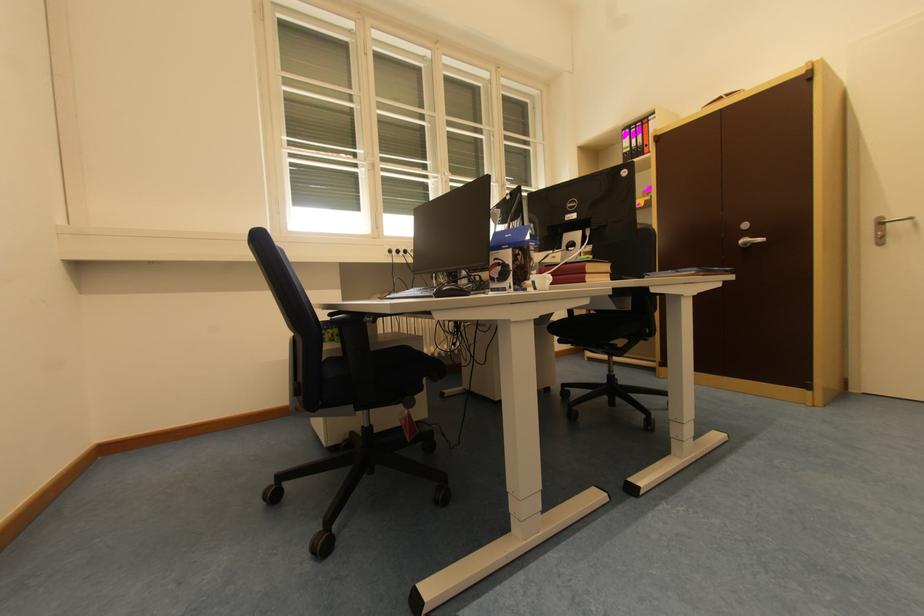
The location [594,272] corresponds to which object?

It refers to a red book.